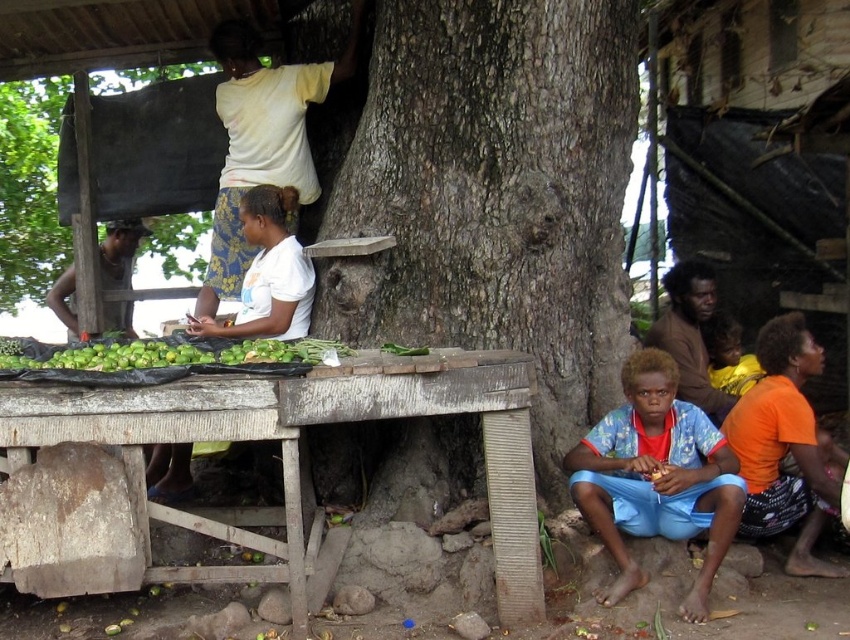
Question: Does brown rough tree trunk at upper center lie in front of yellow clothed child at lower right?

Choices:
 (A) yes
 (B) no

Answer: (B)

Question: Which of these objects is positioned farthest from the brown skin man at left?

Choices:
 (A) brown textured shirt at lower right
 (B) white matte shirt at left
 (C) dark brown rough bark tree at center
 (D) orange fabric at lower right

Answer: (D)

Question: Among these objects, which one is nearest to the camera?

Choices:
 (A) wooden table at lower left
 (B) brown textured shirt at lower right

Answer: (A)

Question: Which of the following is the farthest from the observer?

Choices:
 (A) (505, 76)
 (B) (707, 385)
 (C) (690, 433)

Answer: (B)

Question: Is wooden table at lower left below white matte shirt at left?

Choices:
 (A) no
 (B) yes

Answer: (B)

Question: Can you confirm if orange fabric at lower right is wider than white matte shirt at left?

Choices:
 (A) yes
 (B) no

Answer: (A)